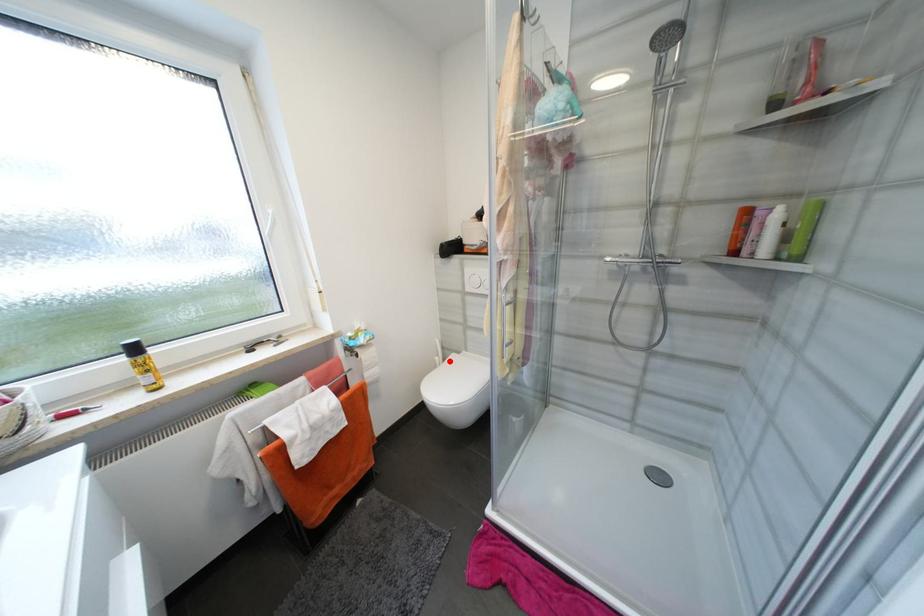
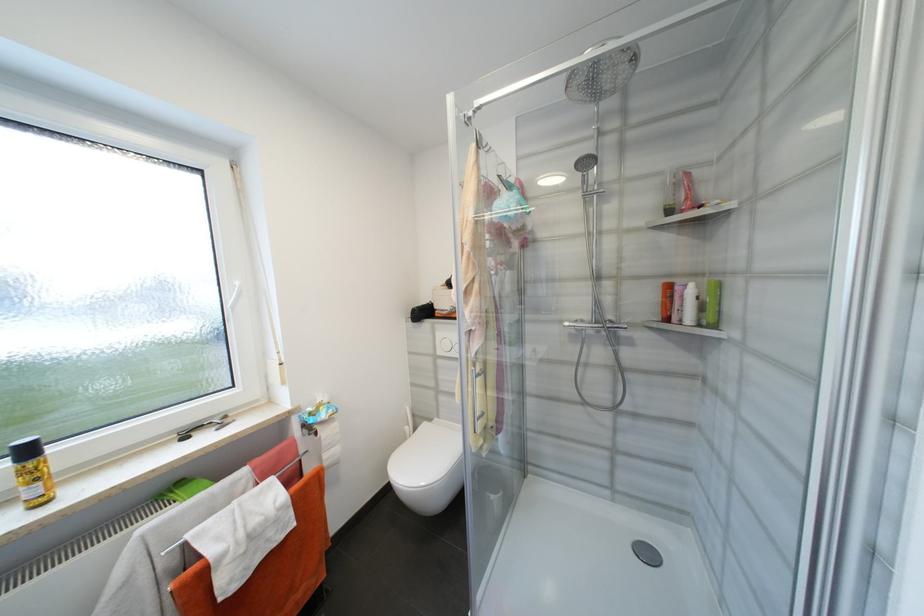
Question: I am providing you with two images of the same scene from different viewpoints. In image1, a red point is highlighted. Considering the same 3D point in image2, which of the following is correct?

Choices:
 (A) It is closer
 (B) It is farther

Answer: (B)